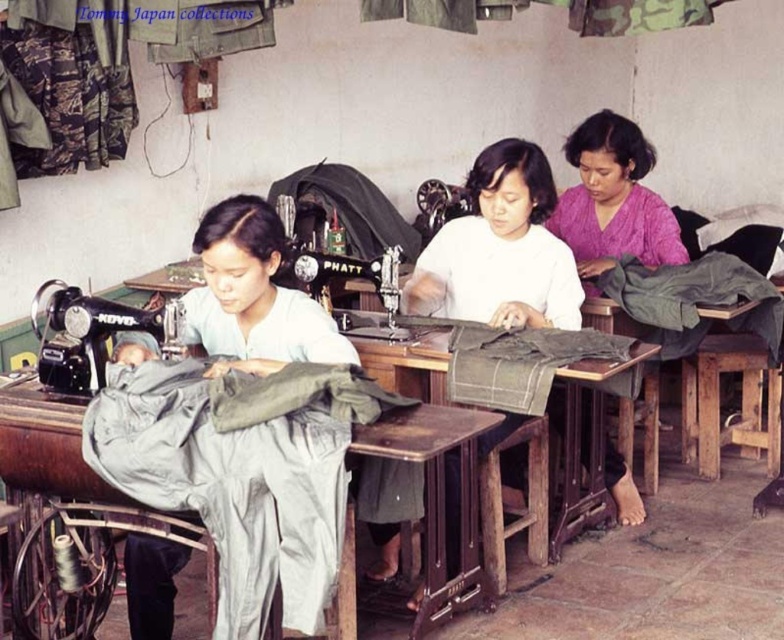
Question: Among these objects, which one is farthest from the camera?

Choices:
 (A) matte gray fabric at center
 (B) white matte shirt at center
 (C) metallic black sewing machine at center

Answer: (C)

Question: Which point appears farthest from the camera in this image?

Choices:
 (A) (463, 202)
 (B) (521, 344)

Answer: (A)

Question: Does white matte shirt at center have a smaller size compared to wooden table at center?

Choices:
 (A) no
 (B) yes

Answer: (B)

Question: From the image, what is the correct spatial relationship of matte gray fabric at center in relation to metallic black sewing machine at center?

Choices:
 (A) below
 (B) above

Answer: (A)

Question: Which point is closer to the camera taking this photo?

Choices:
 (A) (405, 323)
 (B) (505, 189)
 (C) (445, 211)

Answer: (B)

Question: Does matte gray fabric at center appear under metallic black sewing machine at center?

Choices:
 (A) no
 (B) yes

Answer: (B)